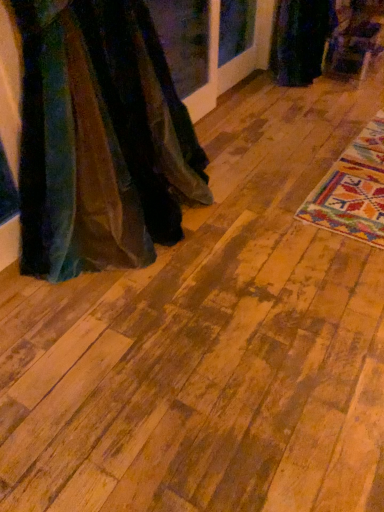
Question: Does velvet fabric dress at left, the second fancy dress from the top, turn towards wooden floor at center?

Choices:
 (A) yes
 (B) no

Answer: (B)

Question: Is velvet fabric dress at left, which is the 2th fancy dress in back-to-front order, thinner than wooden floor at center?

Choices:
 (A) no
 (B) yes

Answer: (B)

Question: From the image's perspective, would you say velvet fabric dress at left, the second fancy dress from the top, is shown under wooden floor at center?

Choices:
 (A) yes
 (B) no

Answer: (A)

Question: Is velvet fabric dress at left, the second fancy dress from the top, at the left side of wooden floor at center?

Choices:
 (A) yes
 (B) no

Answer: (A)

Question: From a real-world perspective, is velvet fabric dress at left, placed as the 1th fancy dress when sorted from left to right, positioned over wooden floor at center based on gravity?

Choices:
 (A) no
 (B) yes

Answer: (B)

Question: In terms of height, does wooden floor at center look taller or shorter compared to velvet fabric dress at left, which is the 2th fancy dress in back-to-front order?

Choices:
 (A) short
 (B) tall

Answer: (A)

Question: Considering the relative positions of wooden floor at center and velvet fabric dress at left, the first fancy dress viewed from the front, in the image provided, is wooden floor at center to the left or to the right of velvet fabric dress at left, the first fancy dress viewed from the front,?

Choices:
 (A) right
 (B) left

Answer: (A)

Question: In terms of size, does wooden floor at center appear bigger or smaller than velvet fabric dress at left, which is the 2th fancy dress in back-to-front order?

Choices:
 (A) big
 (B) small

Answer: (A)

Question: From a real-world perspective, is wooden floor at center above or below velvet fabric dress at left, the second fancy dress when ordered from right to left?

Choices:
 (A) below
 (B) above

Answer: (A)

Question: In the image, is velvet fabric dress at left, which appears as the 1th fancy dress when ordered from the bottom, on the left side or the right side of wooden floor at center?

Choices:
 (A) right
 (B) left

Answer: (B)

Question: Does point (82, 0) appear closer or farther from the camera than point (175, 463)?

Choices:
 (A) closer
 (B) farther

Answer: (B)

Question: Is velvet fabric dress at left, which is the 2th fancy dress in back-to-front order, situated inside wooden floor at center or outside?

Choices:
 (A) outside
 (B) inside

Answer: (A)

Question: In the image, is velvet fabric dress at left, the second fancy dress when ordered from right to left, positioned in front of or behind wooden floor at center?

Choices:
 (A) behind
 (B) front

Answer: (A)

Question: Considering the positions of point (379, 415) and point (276, 25), is point (379, 415) closer or farther from the camera than point (276, 25)?

Choices:
 (A) farther
 (B) closer

Answer: (B)

Question: From a real-world perspective, is wooden floor at center positioned above or below velvet dark green dress at upper right, marked as the second fancy dress in a bottom-to-top arrangement?

Choices:
 (A) below
 (B) above

Answer: (A)